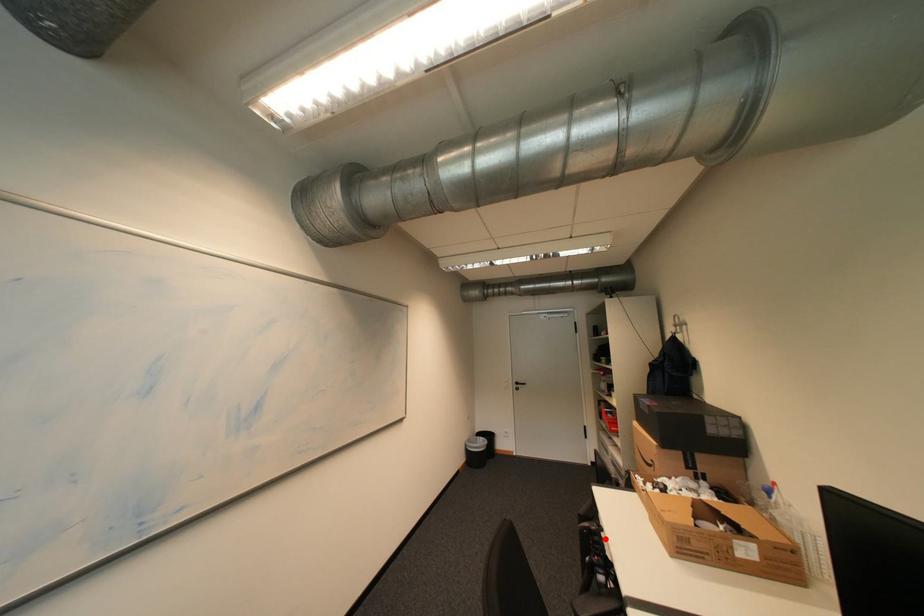
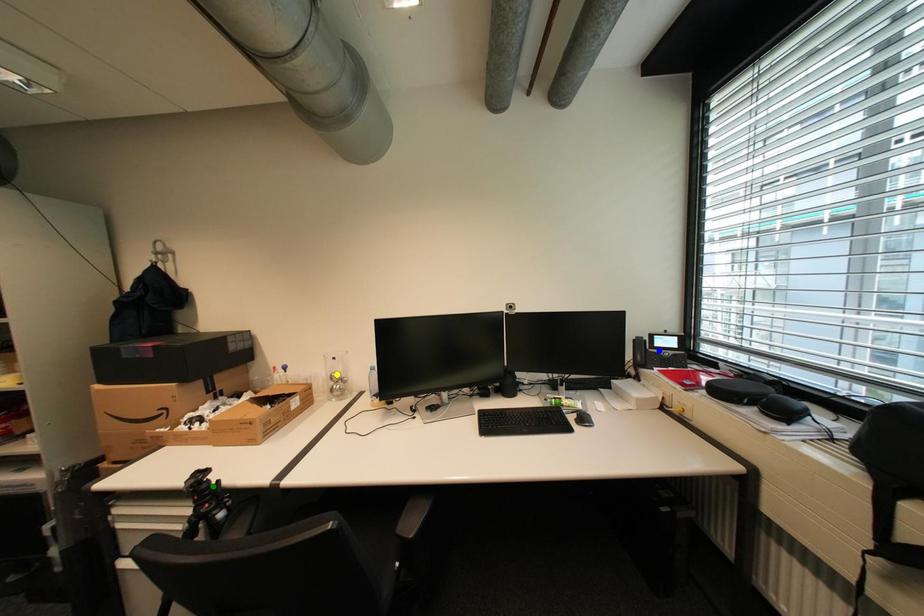
Question: I am providing you with two images of the same scene from different viewpoints. A red point is marked on the first image. You are given multiple points on the second image. Can you choose the point in image 2 that corresponds to the point in image 1?

Choices:
 (A) green point
 (B) blue point
 (C) yellow point

Answer: (A)